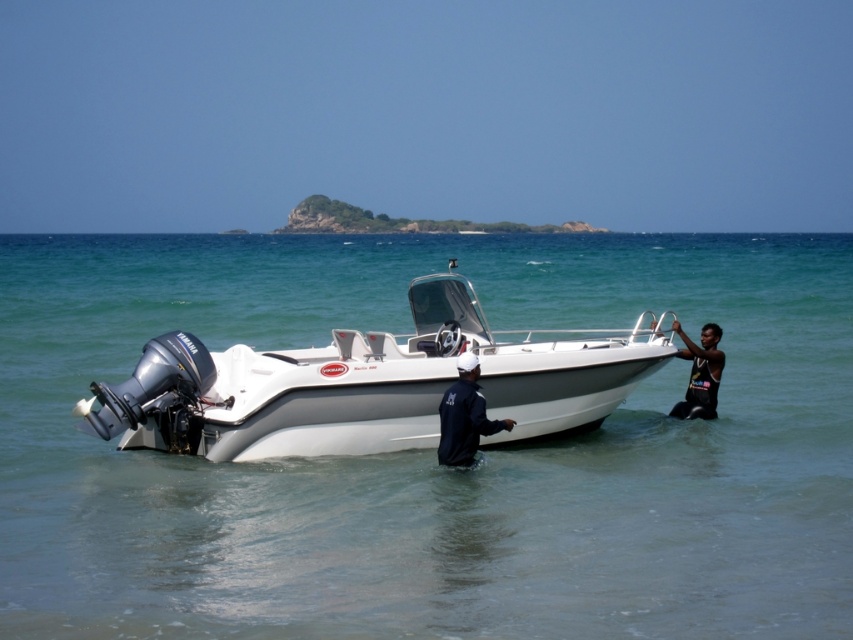
Where is the white glossy boat at center located in the image?

The white glossy boat at center is located at point 0.603 on the x axis and 0.429 on the y axis.

You are a photographer trying to capture a wide shot of the scene. The camera you are using has a maximum width capacity of 1.2 meters. Given the dark blue fabric jacket at center and the black matte wetsuit at right, will both subjects fit within the camera frame if positioned side by side?

The dark blue fabric jacket at center is wider than the black matte wetsuit at right. Since the total width of both together would exceed the camera frame limit of 1.2 meters, they might not fit side by side.